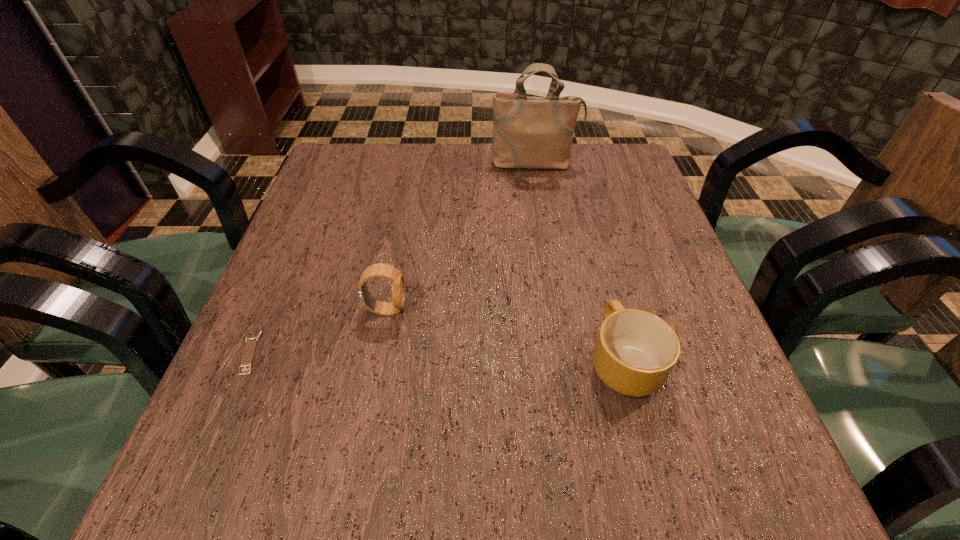
You are a GUI agent. You are given a task and a screenshot of the screen. Output one action in this format:
    pyautogui.click(x=<x>, y=<y>)
    Task: Click on the shoulder bag
    The height and width of the screenshot is (540, 960).
    Given the screenshot: What is the action you would take?
    pyautogui.click(x=529, y=132)

Locate an element on the screen. The image size is (960, 540). the farthest object is located at coordinates (529, 132).

I want to click on the right watch, so click(387, 271).

The image size is (960, 540). Identify the location of the second object from left to right. (387, 271).

At what (x,y) coordinates should I click in order to perform the action: click on the third tallest object. Please return your answer as a coordinate pair (x, y). The width and height of the screenshot is (960, 540). Looking at the image, I should click on (635, 352).

Find the location of a particular element. the nearer watch is located at coordinates (252, 334).

Where is `the shortest object`? the shortest object is located at coordinates (252, 334).

The width and height of the screenshot is (960, 540). Find the location of `free space located 0.080m on the front-facing side of the farthest object`. free space located 0.080m on the front-facing side of the farthest object is located at coordinates (540, 191).

The height and width of the screenshot is (540, 960). What are the coordinates of `vacant area situated on the face of the second tallest object` in the screenshot? It's located at (602, 310).

Where is `blank area located 0.250m on the side with the handle of the third tallest object`? blank area located 0.250m on the side with the handle of the third tallest object is located at coordinates (590, 237).